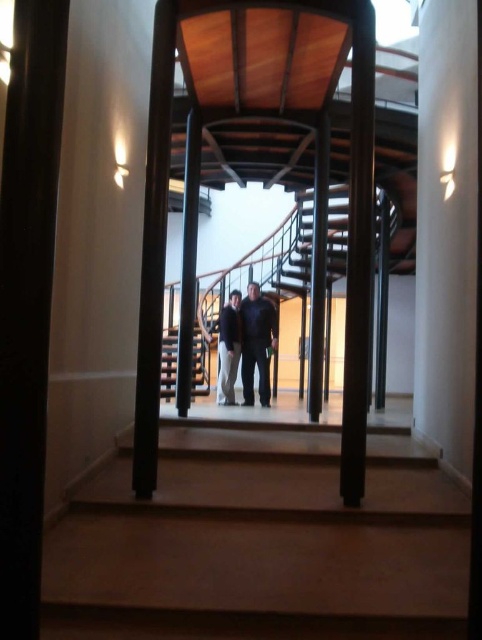
Question: Does wooden stairs at center appear on the right side of dark blue jeans at center?

Choices:
 (A) yes
 (B) no

Answer: (A)

Question: Which point is farther to the camera?

Choices:
 (A) (235, 321)
 (B) (174, 355)
 (C) (244, 448)
 (D) (251, 369)

Answer: (B)

Question: Considering the relative positions of wooden stairs at center and dark blue jeans at center in the image provided, where is wooden stairs at center located with respect to dark blue jeans at center?

Choices:
 (A) right
 (B) left

Answer: (A)

Question: Which point is farther to the camera?

Choices:
 (A) wooden stairs at center
 (B) dark blue fabric pants at center
 (C) wooden at center
 (D) dark blue jeans at center

Answer: (B)

Question: Can you confirm if wooden at center is smaller than dark blue jeans at center?

Choices:
 (A) no
 (B) yes

Answer: (A)

Question: Which point appears farthest from the camera in this image?

Choices:
 (A) (329, 432)
 (B) (228, 353)

Answer: (B)